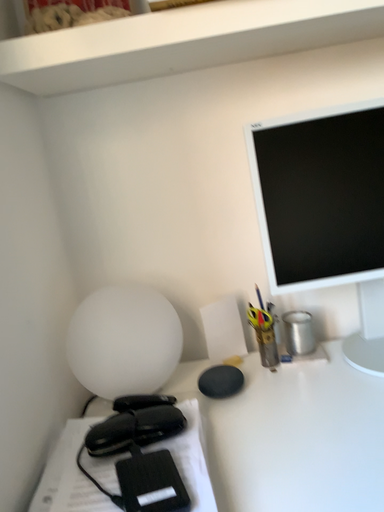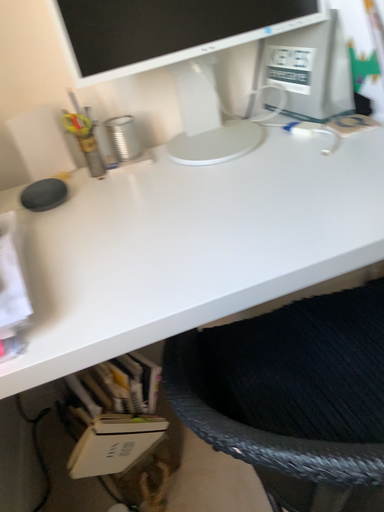
Question: How did the camera likely rotate when shooting the video?

Choices:
 (A) rotated right
 (B) rotated left

Answer: (A)